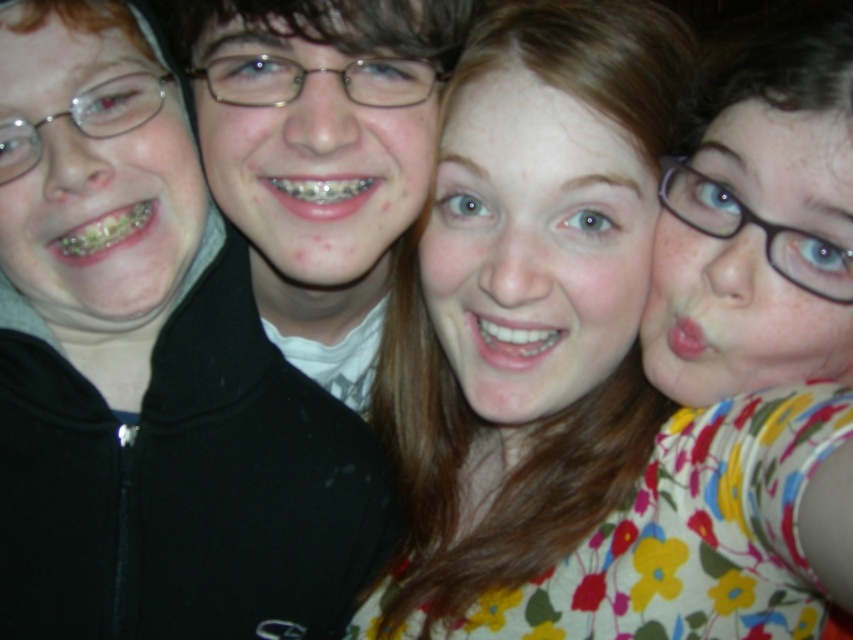
You are standing in front of the group photo and notice the floral fabric dress at center. Can you determine its exact position using the coordinate system provided?

The floral fabric dress at center is located at point [579,454] according to the coordinate system provided.